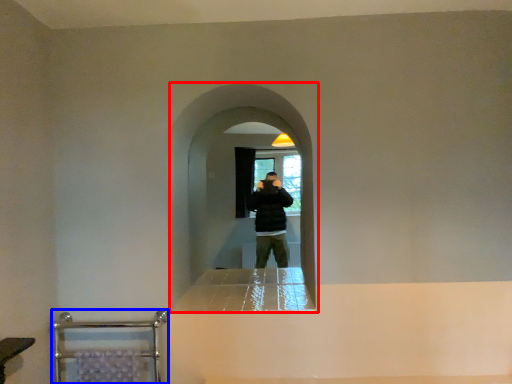
Question: Among these objects, which one is nearest to the camera, screen door (highlighted by a red box) or balustrade (highlighted by a blue box)?

Choices:
 (A) screen door
 (B) balustrade

Answer: (B)